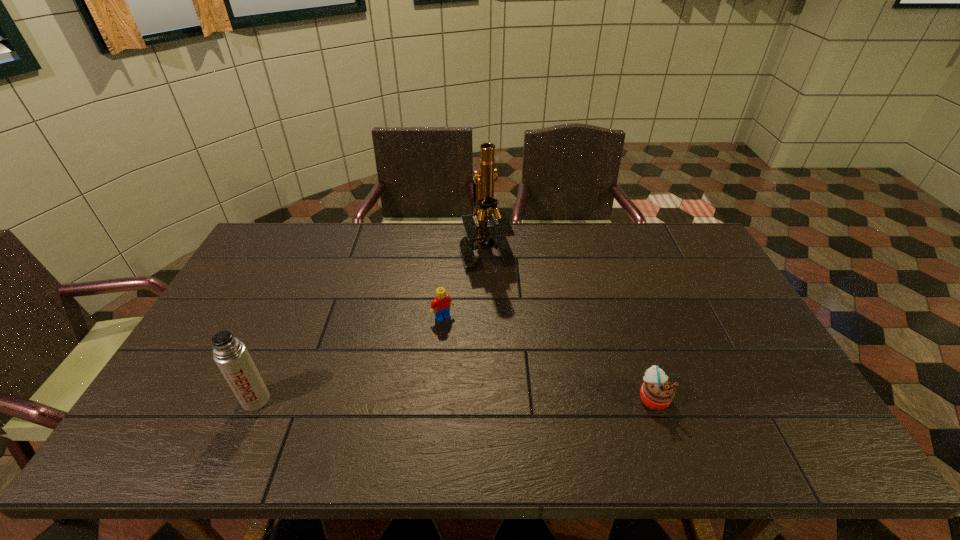
You are a GUI agent. You are given a task and a screenshot of the screen. Output one action in this format:
    pyautogui.click(x=<x>, y=<y>)
    Task: Click on the leftmost object
    The image size is (960, 540).
    Given the screenshot: What is the action you would take?
    pyautogui.click(x=230, y=354)

Identify the location of the third shortest object. This screenshot has width=960, height=540. (230, 354).

Locate an element on the screen. the rightmost object is located at coordinates (657, 393).

Find the location of a particular element. The width and height of the screenshot is (960, 540). Lego is located at coordinates (440, 305).

Locate an element on the screen. The width and height of the screenshot is (960, 540). the third object from right to left is located at coordinates (440, 305).

At what (x,y) coordinates should I click in order to perform the action: click on the tallest object. Please return your answer as a coordinate pair (x, y). Looking at the image, I should click on (478, 234).

Image resolution: width=960 pixels, height=540 pixels. What are the coordinates of `the second object from right to left` in the screenshot? It's located at (478, 234).

Locate an element on the screen. The height and width of the screenshot is (540, 960). vacant point located on the back of the second tallest object is located at coordinates (277, 352).

The height and width of the screenshot is (540, 960). In order to click on vacant position located 0.060m on the front-facing side of the muffin in this screenshot , I will do pyautogui.click(x=693, y=397).

Find the location of a particular element. Image resolution: width=960 pixels, height=540 pixels. vacant area located 0.130m on the face of the third object from right to left is located at coordinates (468, 353).